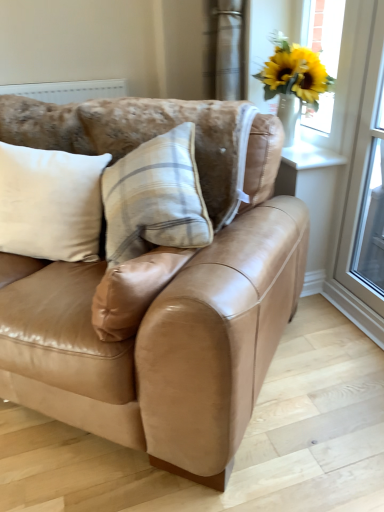
Question: Is yellow artificial flowers in vase at upper right smaller than white soft cushion at left?

Choices:
 (A) no
 (B) yes

Answer: (B)

Question: Is yellow artificial flowers in vase at upper right positioned far away from white soft cushion at left?

Choices:
 (A) no
 (B) yes

Answer: (A)

Question: Could you tell me if yellow artificial flowers in vase at upper right is turned towards white soft cushion at left?

Choices:
 (A) no
 (B) yes

Answer: (B)

Question: Can you confirm if yellow artificial flowers in vase at upper right is bigger than white soft cushion at left?

Choices:
 (A) yes
 (B) no

Answer: (B)

Question: Considering the relative sizes of yellow artificial flowers in vase at upper right and white soft cushion at left in the image provided, is yellow artificial flowers in vase at upper right taller than white soft cushion at left?

Choices:
 (A) no
 (B) yes

Answer: (B)

Question: Would you say yellow artificial flowers in vase at upper right is outside white soft cushion at left?

Choices:
 (A) no
 (B) yes

Answer: (B)

Question: Does transparent glass screen door at right have a greater width compared to yellow artificial flowers in vase at upper right?

Choices:
 (A) no
 (B) yes

Answer: (A)

Question: Considering the relative sizes of transparent glass screen door at right and yellow artificial flowers in vase at upper right in the image provided, is transparent glass screen door at right taller than yellow artificial flowers in vase at upper right?

Choices:
 (A) no
 (B) yes

Answer: (B)

Question: From the image's perspective, is transparent glass screen door at right located beneath yellow artificial flowers in vase at upper right?

Choices:
 (A) yes
 (B) no

Answer: (A)

Question: Is transparent glass screen door at right directly adjacent to yellow artificial flowers in vase at upper right?

Choices:
 (A) yes
 (B) no

Answer: (B)

Question: Is transparent glass screen door at right facing towards yellow artificial flowers in vase at upper right?

Choices:
 (A) yes
 (B) no

Answer: (B)

Question: Is transparent glass screen door at right positioned with its back to yellow artificial flowers in vase at upper right?

Choices:
 (A) yes
 (B) no

Answer: (B)

Question: Is transparent glass screen door at right bigger than white soft cushion at left?

Choices:
 (A) yes
 (B) no

Answer: (A)